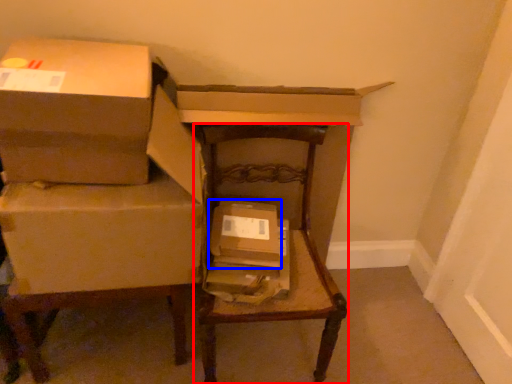
Question: Which point is closer to the camera, furniture (highlighted by a red box) or box (highlighted by a blue box)?

Choices:
 (A) furniture
 (B) box

Answer: (A)